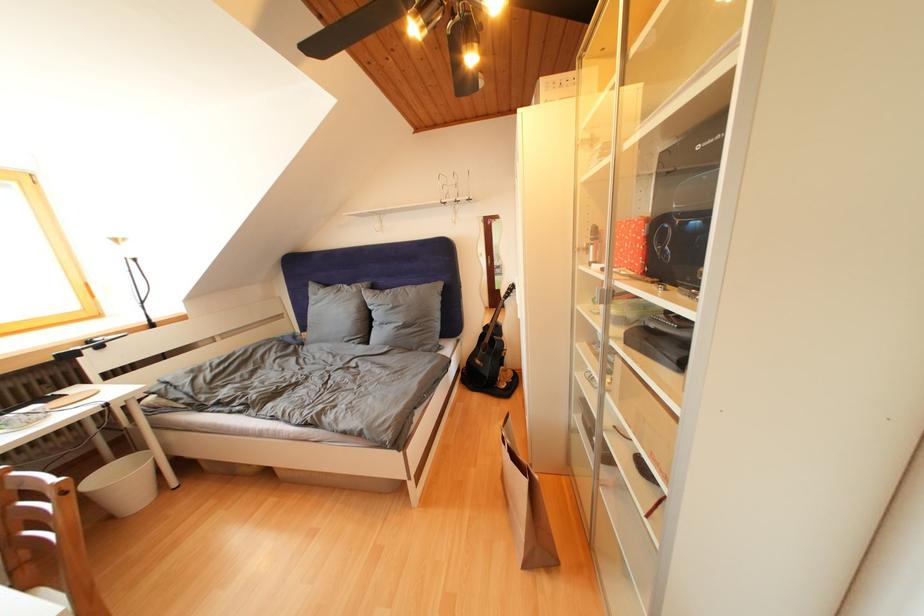
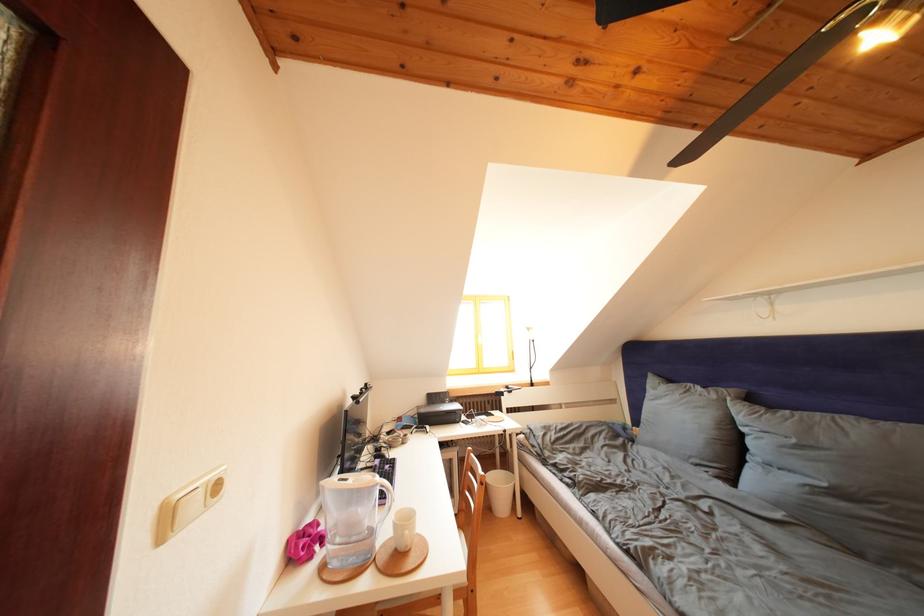
Find the pixel in the second image that matches (x=398, y=310) in the first image.

(801, 446)